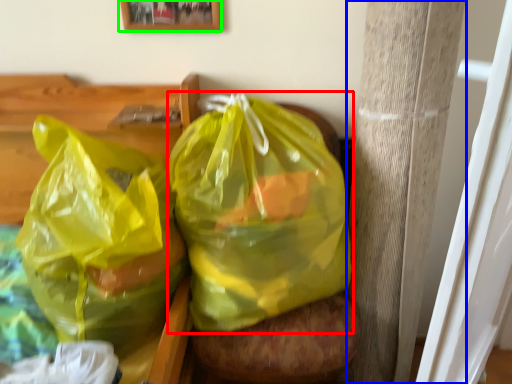
Question: Considering the real-world distances, which object is closest to plastic bag (highlighted by a red box)? pillar (highlighted by a blue box) or picture frame (highlighted by a green box).

Choices:
 (A) pillar
 (B) picture frame

Answer: (A)